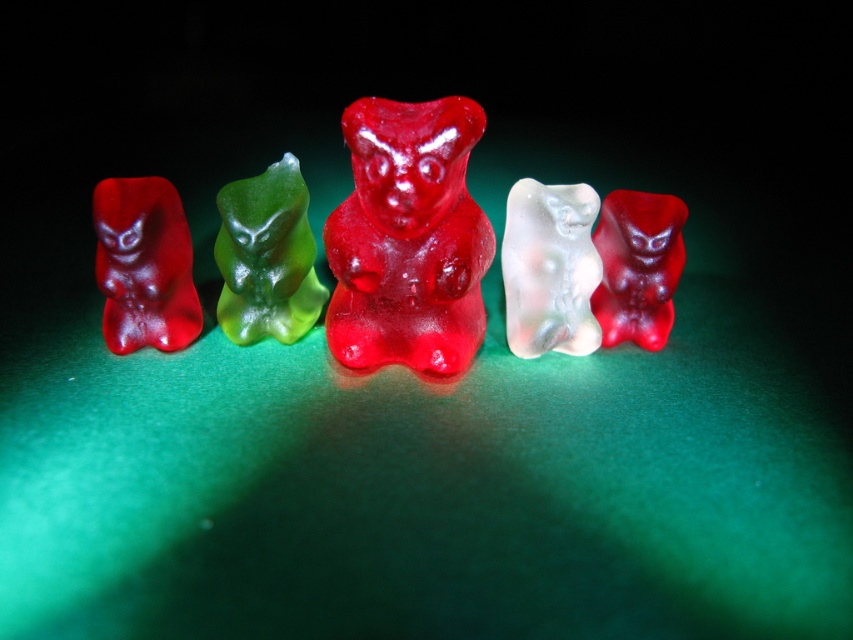
Does green translucent bear at center appear on the right side of translucent white bear at center?

In fact, green translucent bear at center is to the left of translucent white bear at center.

Who is positioned more to the left, green translucent bear at center or translucent white bear at center?

green translucent bear at center

Is point (294, 321) positioned before point (526, 177)?

Yes, point (294, 321) is closer to viewer.

Find the location of a particular element. The width and height of the screenshot is (853, 640). green translucent bear at center is located at coordinates (265, 257).

Who is lower down, matte red gummy bear at left or translucent white bear at center?

matte red gummy bear at left

In the scene shown: Which is more to the left, matte red gummy bear at left or translucent white bear at center?

Positioned to the left is matte red gummy bear at left.

The image size is (853, 640). Find the location of `matte red gummy bear at left`. matte red gummy bear at left is located at coordinates (144, 266).

Who is positioned more to the right, translucent white bear at center or translucent red bear at right?

From the viewer's perspective, translucent red bear at right appears more on the right side.

Between translucent white bear at center and translucent red bear at right, which one is positioned higher?

Positioned higher is translucent white bear at center.

Between point (535, 292) and point (643, 237), which one is positioned in front?

Point (643, 237)

You are a GUI agent. You are given a task and a screenshot of the screen. Output one action in this format:
    pyautogui.click(x=<x>, y=<y>)
    Task: Click on the translucent white bear at center
    
    Given the screenshot: What is the action you would take?
    pyautogui.click(x=550, y=268)